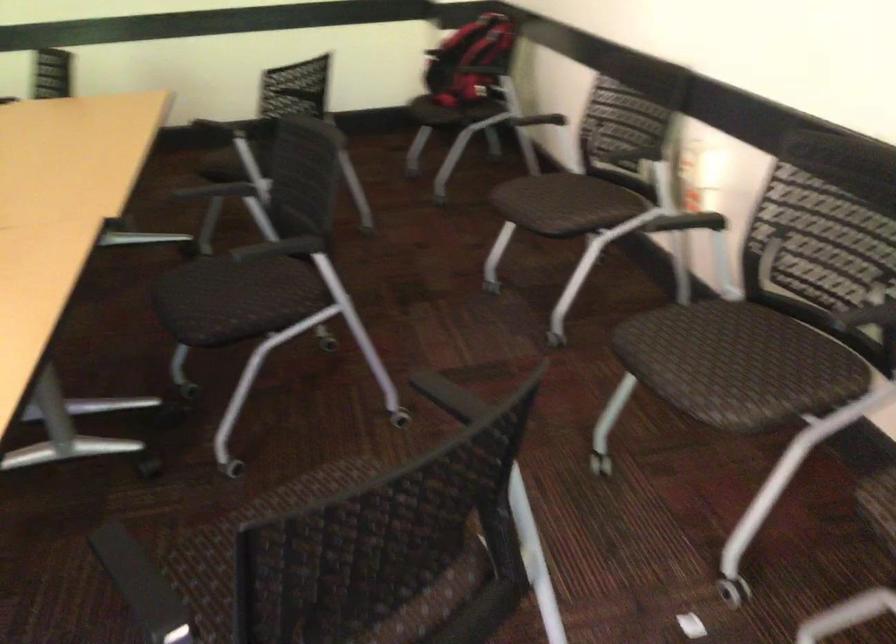
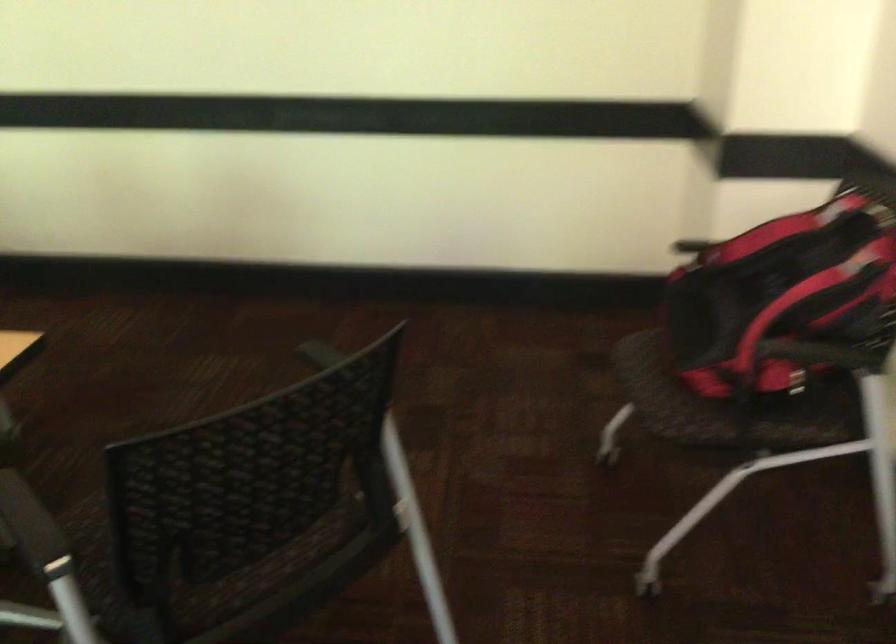
Locate, in the second image, the point that corresponds to [415,102] in the first image.

(647, 395)